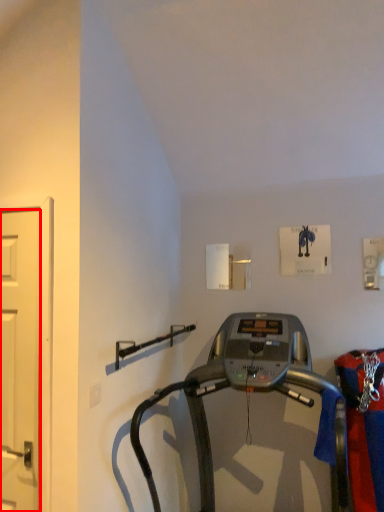
Question: From the image, what is the correct spatial relationship of door (annotated by the red box) in relation to treadmill?

Choices:
 (A) right
 (B) left

Answer: (B)